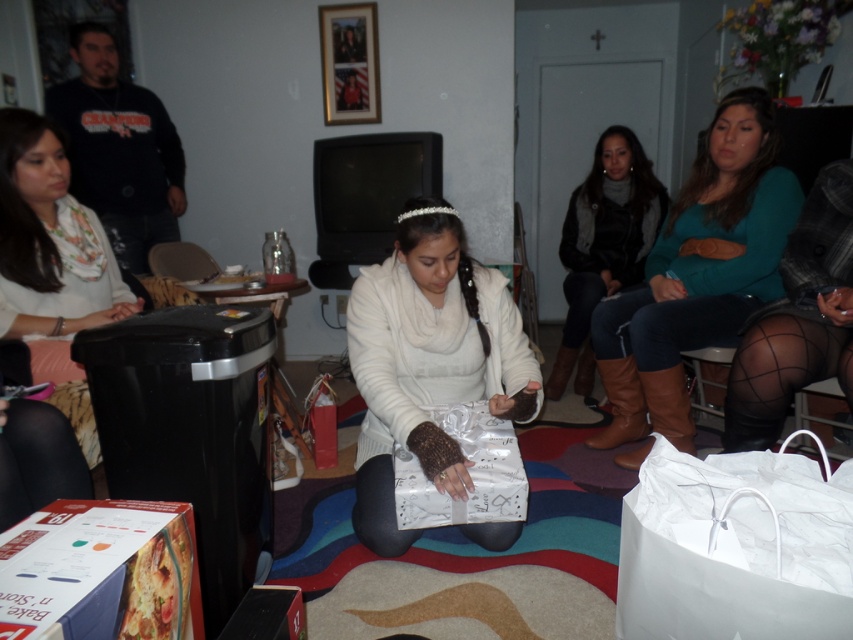
Between white cardboard box at lower left and dark brown leather boots at center right, which one is positioned higher?

dark brown leather boots at center right is higher up.

Is white cardboard box at lower left to the left of dark brown leather boots at center right from the viewer's perspective?

Indeed, white cardboard box at lower left is positioned on the left side of dark brown leather boots at center right.

Describe the element at coordinates (100, 572) in the screenshot. I see `white cardboard box at lower left` at that location.

Where is `white cardboard box at lower left`? white cardboard box at lower left is located at coordinates (100, 572).

Is point (720, 456) farther from viewer compared to point (44, 128)?

No, (720, 456) is in front of (44, 128).

What do you see at coordinates (735, 547) in the screenshot? The image size is (853, 640). I see `white paper bag at lower right` at bounding box center [735, 547].

Is point (778, 502) positioned after point (28, 116)?

That is False.

This screenshot has height=640, width=853. Find the location of `white paper bag at lower right`. white paper bag at lower right is located at coordinates (735, 547).

This screenshot has width=853, height=640. What do you see at coordinates (735, 547) in the screenshot?
I see `white paper bag at lower right` at bounding box center [735, 547].

Is white paper bag at lower right wider than white cardboard box at lower left?

Yes, white paper bag at lower right is wider than white cardboard box at lower left.

Is point (848, 486) closer to viewer compared to point (4, 586)?

No.

You are a GUI agent. You are given a task and a screenshot of the screen. Output one action in this format:
    pyautogui.click(x=<x>, y=<y>)
    Task: Click on the white paper bag at lower right
    The image size is (853, 640).
    Given the screenshot: What is the action you would take?
    pyautogui.click(x=735, y=547)